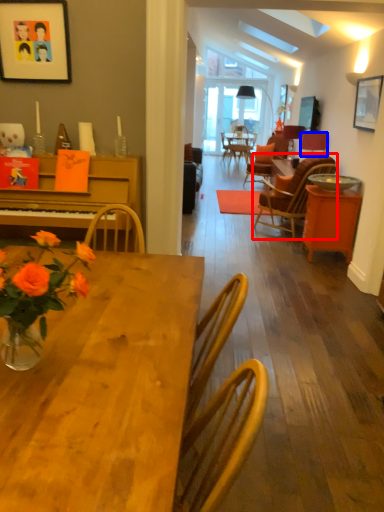
Question: Which object is closer to the camera taking this photo, chair (highlighted by a red box) or lamp (highlighted by a blue box)?

Choices:
 (A) chair
 (B) lamp

Answer: (A)